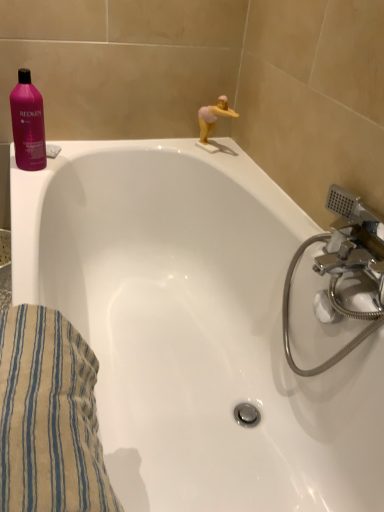
Describe the element at coordinates (28, 124) in the screenshot. I see `pink glossy shampoo at upper left` at that location.

Measure the distance between pink rubber duck at upper right and camera.

The depth of pink rubber duck at upper right is 1.34 meters.

This screenshot has height=512, width=384. What are the coordinates of `pink glossy shampoo at upper left` in the screenshot? It's located at (28, 124).

Is white glossy bathtub at upper left surrounded by pink glossy shampoo at upper left?

That's incorrect, white glossy bathtub at upper left is not inside pink glossy shampoo at upper left.

Which is nearer, [21,120] or [356,431]?

Point [21,120] is farther from the camera than point [356,431].

Is pink glossy shampoo at upper left next to white glossy bathtub at upper left and touching it?

No, pink glossy shampoo at upper left is not with white glossy bathtub at upper left.

From the image's perspective, is pink glossy shampoo at upper left above or below white glossy bathtub at upper left?

Clearly, from the image's perspective, pink glossy shampoo at upper left is above white glossy bathtub at upper left.

Considering the positions of objects white glossy bathtub at upper left and pink glossy shampoo at upper left in the image provided, who is more to the left, white glossy bathtub at upper left or pink glossy shampoo at upper left?

From the viewer's perspective, pink glossy shampoo at upper left appears more on the left side.

Considering the sizes of white glossy bathtub at upper left and pink glossy shampoo at upper left in the image, is white glossy bathtub at upper left wider or thinner than pink glossy shampoo at upper left?

white glossy bathtub at upper left is wider than pink glossy shampoo at upper left.

Which object is further away from the camera, white glossy bathtub at upper left or pink glossy shampoo at upper left?

pink glossy shampoo at upper left.

You are a GUI agent. You are given a task and a screenshot of the screen. Output one action in this format:
    pyautogui.click(x=<x>, y=<y>)
    Task: Click on the cleaning product that is behind the white glossy bathtub at upper left
    The height and width of the screenshot is (512, 384).
    Given the screenshot: What is the action you would take?
    pyautogui.click(x=28, y=124)

Can you confirm if white glossy bathtub at upper left is thinner than pink rubber duck at upper right?

No, white glossy bathtub at upper left is not thinner than pink rubber duck at upper right.

Consider the image. Is white glossy bathtub at upper left inside the boundaries of pink rubber duck at upper right, or outside?

white glossy bathtub at upper left is spatially situated outside pink rubber duck at upper right.

From a real-world perspective, is white glossy bathtub at upper left positioned under pink rubber duck at upper right based on gravity?

Yes, from a real-world perspective, white glossy bathtub at upper left is beneath pink rubber duck at upper right.

Considering the positions of point (126, 217) and point (217, 112), is point (126, 217) closer or farther from the camera than point (217, 112)?

Point (126, 217).

This screenshot has width=384, height=512. Find the location of `cleaning product in front of the pink rubber duck at upper right`. cleaning product in front of the pink rubber duck at upper right is located at coordinates (28, 124).

Considering the sizes of pink rubber duck at upper right and pink glossy shampoo at upper left in the image, is pink rubber duck at upper right wider or thinner than pink glossy shampoo at upper left?

Clearly, pink rubber duck at upper right has less width compared to pink glossy shampoo at upper left.

Is pink rubber duck at upper right not inside pink glossy shampoo at upper left?

Indeed, pink rubber duck at upper right is completely outside pink glossy shampoo at upper left.

From the image's perspective, between pink rubber duck at upper right and pink glossy shampoo at upper left, who is located below?

pink glossy shampoo at upper left is shown below in the image.

Between beige striped towel at lower left and pink rubber duck at upper right, which one has less height?

pink rubber duck at upper right.

Does beige striped towel at lower left turn towards pink rubber duck at upper right?

No, beige striped towel at lower left is not turned towards pink rubber duck at upper right.

From the image's perspective, would you say beige striped towel at lower left is shown under pink rubber duck at upper right?

Yes.

Considering the relative positions of beige striped towel at lower left and pink rubber duck at upper right in the image provided, is beige striped towel at lower left to the left of pink rubber duck at upper right from the viewer's perspective?

Yes, beige striped towel at lower left is to the left of pink rubber duck at upper right.

Where is `bathtub below the beige striped towel at lower left (from a real-world perspective)`? The height and width of the screenshot is (512, 384). bathtub below the beige striped towel at lower left (from a real-world perspective) is located at coordinates (194, 328).

Which of these two, beige striped towel at lower left or white glossy bathtub at upper left, is smaller?

beige striped towel at lower left.

Considering the relative sizes of beige striped towel at lower left and white glossy bathtub at upper left in the image provided, is beige striped towel at lower left taller than white glossy bathtub at upper left?

No.

How different are the orientations of beige striped towel at lower left and white glossy bathtub at upper left in degrees?

The angular difference between beige striped towel at lower left and white glossy bathtub at upper left is 0.769 degrees.

Looking at the image, does white glossy bathtub at upper left seem bigger or smaller compared to beige striped towel at lower left?

white glossy bathtub at upper left is bigger than beige striped towel at lower left.

Which is nearer, (x=89, y=334) or (x=6, y=460)?

The point (x=6, y=460) is closer.

From a real-world perspective, does white glossy bathtub at upper left stand above beige striped towel at lower left?

Answer: No, from a real-world perspective, white glossy bathtub at upper left is not over beige striped towel at lower left

Identify the location of cleaning product to the left of white glossy bathtub at upper left. (28, 124).

Identify the location of bathtub that appears below the pink glossy shampoo at upper left (from a real-world perspective). (194, 328).

When comparing their distances from pink rubber duck at upper right, does pink glossy shampoo at upper left or beige striped towel at lower left seem closer?

pink glossy shampoo at upper left is positioned closer to the anchor pink rubber duck at upper right.

From the picture: When comparing their distances from white glossy bathtub at upper left, does pink rubber duck at upper right or beige striped towel at lower left seem closer?

beige striped towel at lower left lies closer to white glossy bathtub at upper left than the other object.

Looking at this image, when comparing their distances from pink glossy shampoo at upper left, does beige striped towel at lower left or pink rubber duck at upper right seem closer?

pink rubber duck at upper right is positioned closer to the anchor pink glossy shampoo at upper left.

Consider the image. When comparing their distances from beige striped towel at lower left, does pink rubber duck at upper right or pink glossy shampoo at upper left seem further?

pink rubber duck at upper right is further to beige striped towel at lower left.

When comparing their distances from beige striped towel at lower left, does white glossy bathtub at upper left or pink glossy shampoo at upper left seem closer?

Based on the image, white glossy bathtub at upper left appears to be nearer to beige striped towel at lower left.

Considering their positions, is beige striped towel at lower left positioned closer to white glossy bathtub at upper left than pink rubber duck at upper right?

beige striped towel at lower left.

Estimate the real-world distances between objects in this image. Which object is closer to white glossy bathtub at upper left, beige striped towel at lower left or pink glossy shampoo at upper left?

beige striped towel at lower left lies closer to white glossy bathtub at upper left than the other object.

Looking at this image, considering their positions, is beige striped towel at lower left positioned closer to pink rubber duck at upper right than white glossy bathtub at upper left?

white glossy bathtub at upper left is closer to pink rubber duck at upper right.

You are a GUI agent. You are given a task and a screenshot of the screen. Output one action in this format:
    pyautogui.click(x=<x>, y=<y>)
    Task: Click on the bath towel between white glossy bathtub at upper left and pink rubber duck at upper right from front to back
    This screenshot has width=384, height=512.
    Given the screenshot: What is the action you would take?
    pyautogui.click(x=49, y=417)

In order to click on bathtub between pink glossy shampoo at upper left and beige striped towel at lower left from top to bottom in this screenshot , I will do `click(194, 328)`.

At what (x,y) coordinates should I click in order to perform the action: click on cleaning product between white glossy bathtub at upper left and pink rubber duck at upper right along the z-axis. Please return your answer as a coordinate pair (x, y). The width and height of the screenshot is (384, 512). Looking at the image, I should click on (28, 124).

Locate an element on the screen. This screenshot has height=512, width=384. cleaning product positioned between beige striped towel at lower left and pink rubber duck at upper right from near to far is located at coordinates (28, 124).